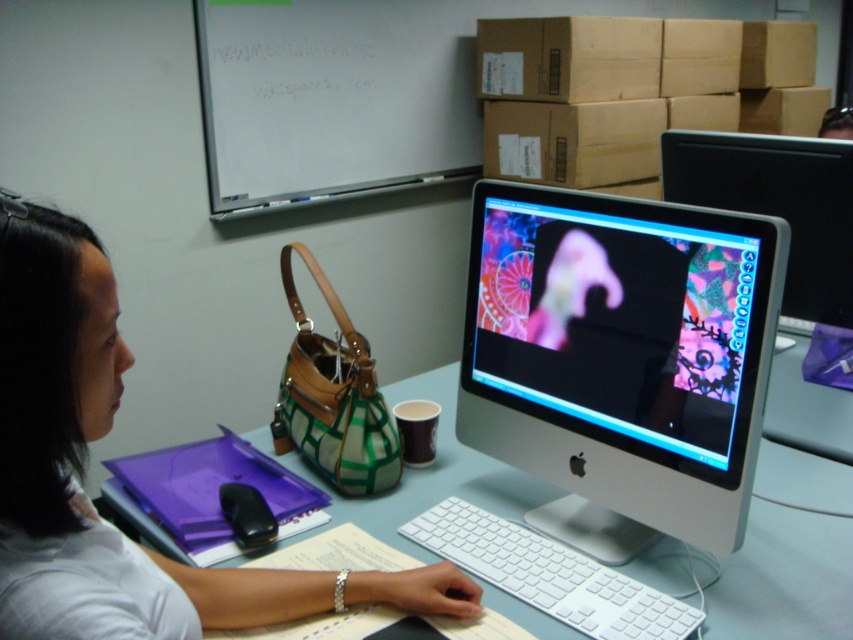
You are standing at the position of point (672,161) and want to reach point (338,189). Can you walk directly towards it without moving around any objects on the desk?

Yes, you can walk directly towards point (338,189) from point (672,161) because point (338,189) is behind point (672,161), meaning there is a clear path between them.

You are an office worker who needs to write a note. You have a marker in your hand and see the whiteboard at upper center and the black plastic mouse at lower center. Which object should you use the marker on?

The whiteboard at upper center is positioned on the right side of the black plastic mouse at lower center. Since the whiteboard is meant for writing, you should use the marker on the whiteboard at upper center.

You are an office worker who needs to write a long meeting agenda. The whiteboard at upper center and the matte plastic monitor at upper right are both available. Which surface can accommodate more text without needing to scroll or move the view?

The whiteboard at upper center can accommodate more text without needing to scroll or move the view because its width surpasses that of the matte plastic monitor at upper right.